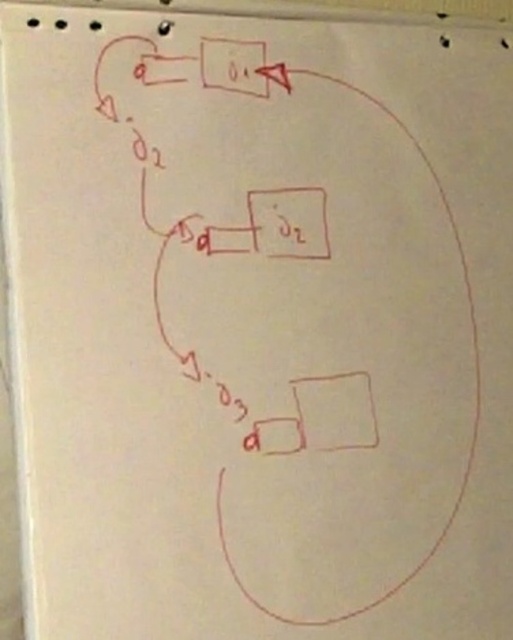
Question: Can you confirm if white paper notepad at lower right is positioned to the left of matte black rectangle at center?

Choices:
 (A) yes
 (B) no

Answer: (B)

Question: Observing the image, what is the correct spatial positioning of white paper notepad at lower right in reference to matte black rectangle at center?

Choices:
 (A) above
 (B) below

Answer: (B)

Question: Considering the relative positions of white paper notepad at lower right and matte black rectangle at center in the image provided, where is white paper notepad at lower right located with respect to matte black rectangle at center?

Choices:
 (A) right
 (B) left

Answer: (A)

Question: Which point is closer to the camera?

Choices:
 (A) (320, 445)
 (B) (251, 211)

Answer: (A)

Question: Which of the following is the closest to the observer?

Choices:
 (A) (317, 189)
 (B) (343, 435)

Answer: (B)